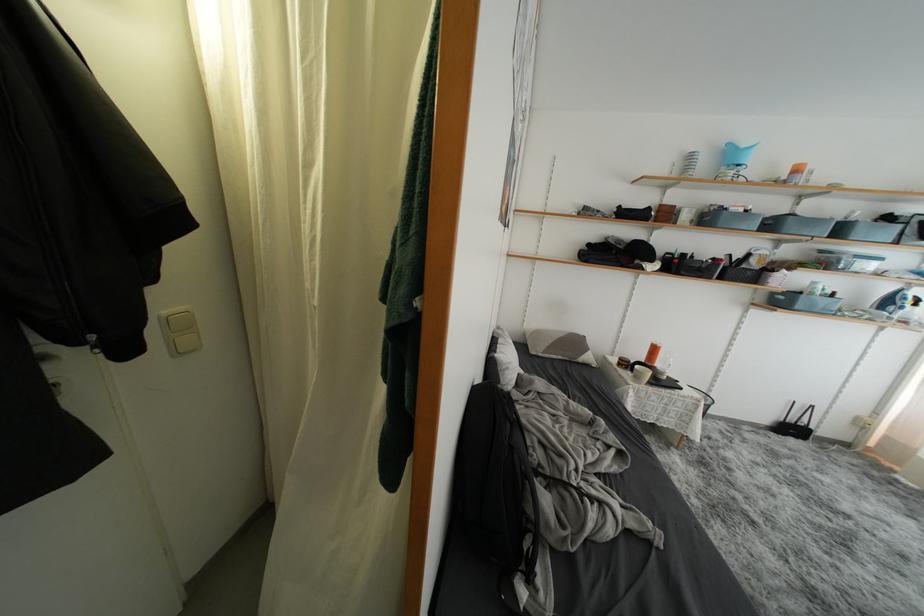
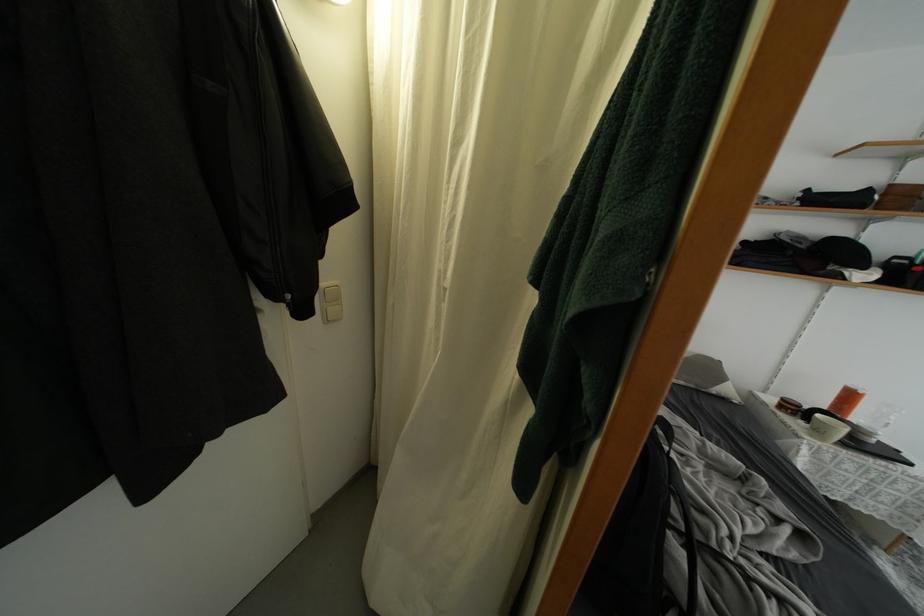
The point at (642, 382) is marked in the first image. Where is the corresponding point in the second image?

(823, 437)